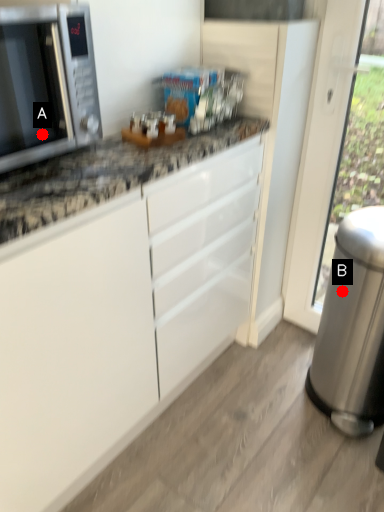
Question: Two points are circled on the image, labeled by A and B beside each circle. Which point is closer to the camera?

Choices:
 (A) A is closer
 (B) B is closer

Answer: (A)